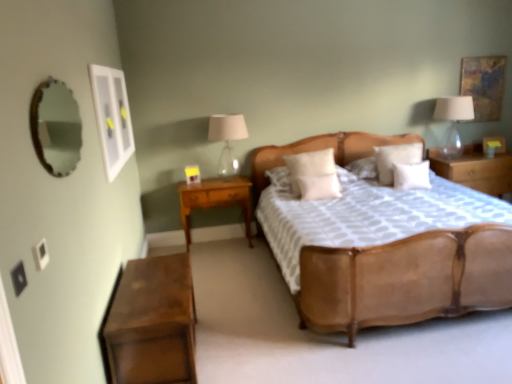
Identify the location of free location to the right of wooden nightstand at lower left, the 1th nightstand when ordered from front to back. This screenshot has width=512, height=384. (256, 342).